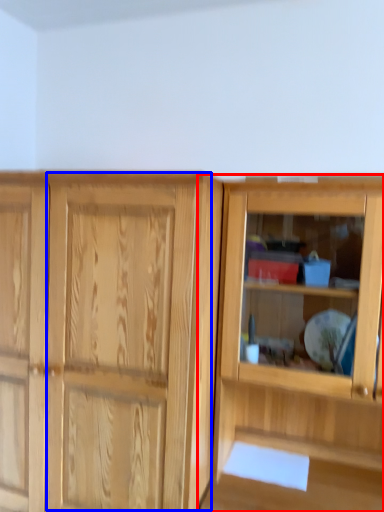
Question: Which point is further to the camera, cupboard (highlighted by a red box) or screen door (highlighted by a blue box)?

Choices:
 (A) cupboard
 (B) screen door

Answer: (B)